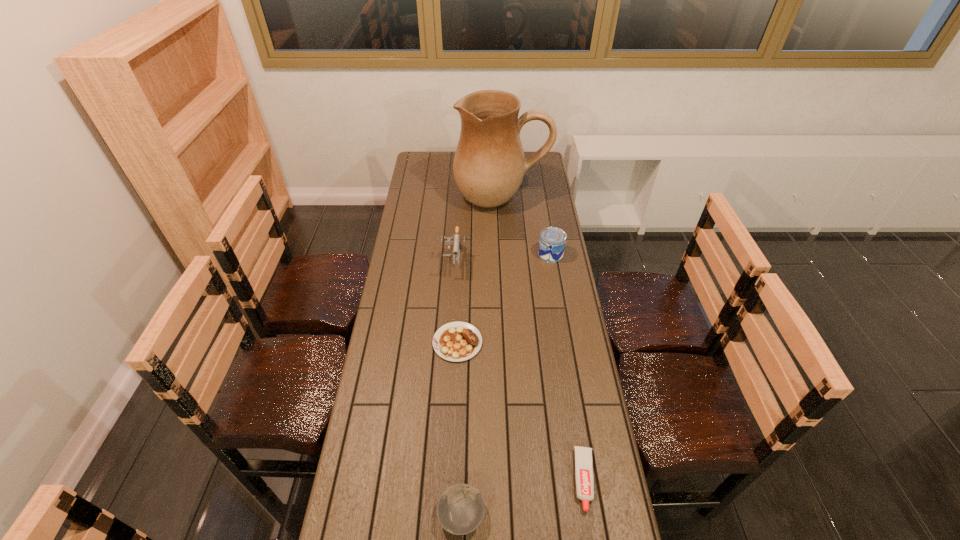
Find the location of a particular element. The image size is (960, 540). free space in the image that satisfies the following two spatial constraints: 1. at the spout of the toothpaste; 2. on the left side of the tallest object is located at coordinates (517, 480).

Find the location of a particular element. The width and height of the screenshot is (960, 540). vacant space that satisfies the following two spatial constraints: 1. at the barrel end of the second tallest object; 2. on the left side of the third nearest object is located at coordinates (448, 342).